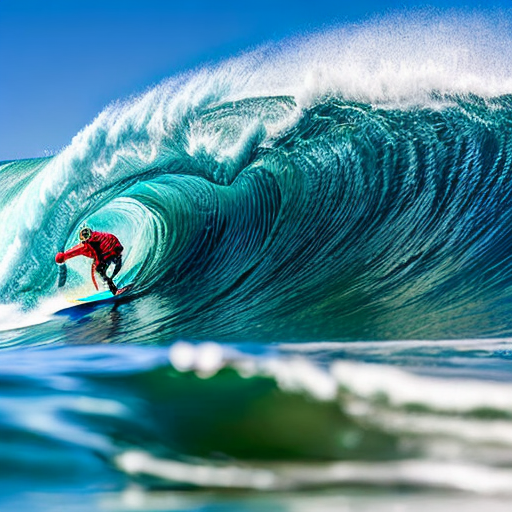
This screenshot has height=512, width=512. Find the location of `coat`. coat is located at coordinates [x=112, y=233].